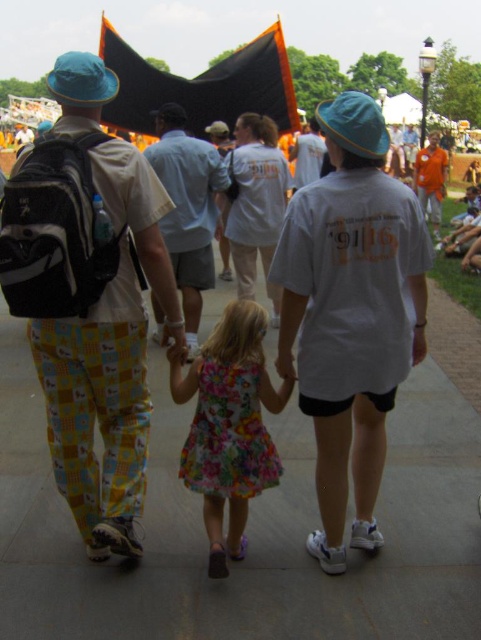
Question: Does orange cotton shirt at upper right appear on the right side of white matte shirt at center?

Choices:
 (A) no
 (B) yes

Answer: (B)

Question: Which point is closer to the camera taking this photo?

Choices:
 (A) (390, 305)
 (B) (99, 307)
 (C) (215, 481)

Answer: (B)

Question: Which is farther from the gray cotton shirt at center?

Choices:
 (A) floral fabric dress at center
 (B) light blue cotton shirt at center
 (C) printed cotton pants at left

Answer: (B)

Question: Does floral fabric dress at center have a smaller size compared to light blue cotton shirt at center?

Choices:
 (A) yes
 (B) no

Answer: (A)

Question: Is white cotton shirt at center smaller than white matte shirt at center?

Choices:
 (A) yes
 (B) no

Answer: (B)

Question: Which point is farther from the camera taking this photo?

Choices:
 (A) (325, 467)
 (B) (92, 260)
 (C) (244, 481)
 (D) (179, 276)

Answer: (D)